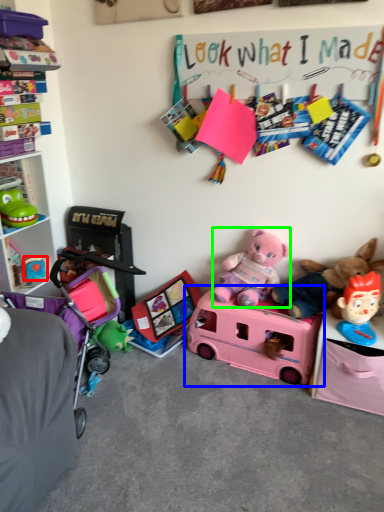
Question: Considering the real-world distances, which object is farthest from toy (highlighted by a red box)? toy (highlighted by a blue box) or teddy bear (highlighted by a green box)?

Choices:
 (A) toy
 (B) teddy bear

Answer: (A)